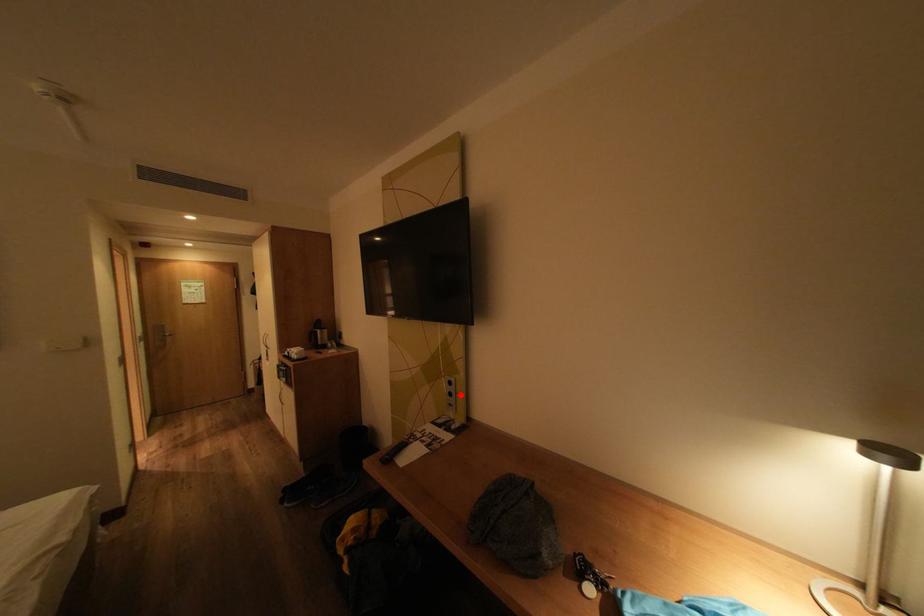
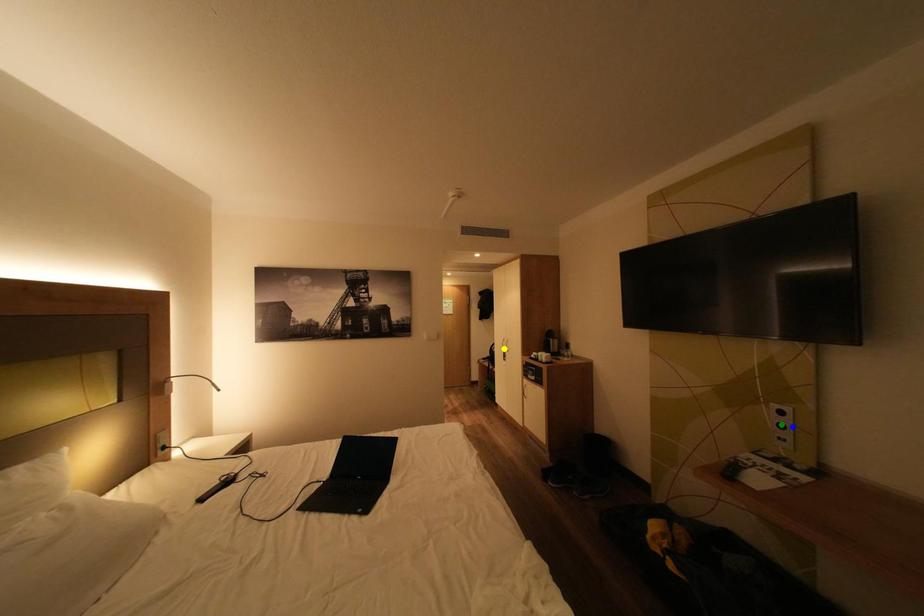
Question: I am providing you with two images of the same scene from different viewpoints. A red point is marked on the first image. You are given multiple points on the second image. Which point in image 2 is actually the same real-world point as the red point in image 1?

Choices:
 (A) yellow point
 (B) green point
 (C) blue point

Answer: (C)